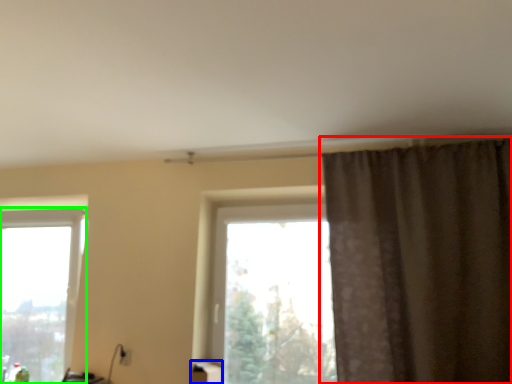
Question: Considering the real-world distances, which object is farthest from curtain (highlighted by a red box)? furniture (highlighted by a blue box) or window (highlighted by a green box)?

Choices:
 (A) furniture
 (B) window

Answer: (B)